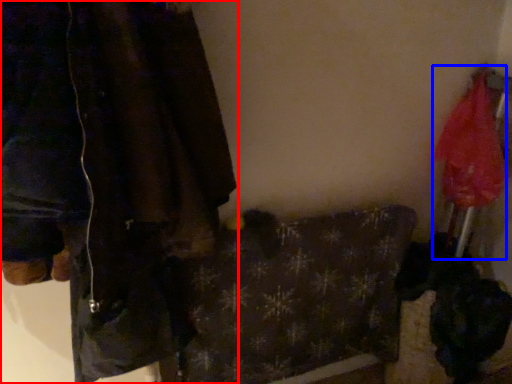
Question: Which object is further to the camera taking this photo, jacket (highlighted by a red box) or umbrella (highlighted by a blue box)?

Choices:
 (A) jacket
 (B) umbrella

Answer: (B)